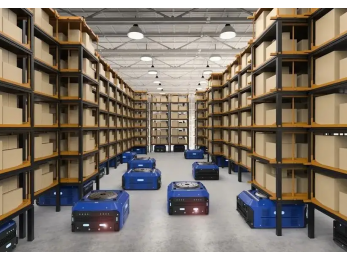
The image size is (347, 260). I want to click on the left side ceiling light, so click(x=134, y=37), click(x=145, y=58), click(x=150, y=71), click(x=155, y=81), click(x=159, y=89).